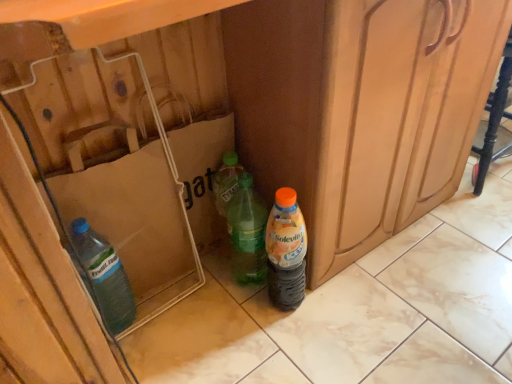
Question: Is orange matte plastic bottle at lower right, marked as the first bottle in a right-to-left arrangement, positioned far away from green translucent bottle at center, positioned as the 2th bottle in right-to-left order?

Choices:
 (A) yes
 (B) no

Answer: (B)

Question: Considering the relative positions of orange matte plastic bottle at lower right, which is the second bottle from left to right, and green translucent bottle at center, the 1th bottle from the left, in the image provided, is orange matte plastic bottle at lower right, which is the second bottle from left to right, to the left of green translucent bottle at center, the 1th bottle from the left, from the viewer's perspective?

Choices:
 (A) yes
 (B) no

Answer: (B)

Question: Is orange matte plastic bottle at lower right, marked as the first bottle in a right-to-left arrangement, outside green translucent bottle at center, positioned as the 2th bottle in right-to-left order?

Choices:
 (A) yes
 (B) no

Answer: (A)

Question: Is orange matte plastic bottle at lower right, marked as the first bottle in a right-to-left arrangement, in contact with green translucent bottle at center, the 1th bottle from the left?

Choices:
 (A) yes
 (B) no

Answer: (A)

Question: Could you tell me if orange matte plastic bottle at lower right, marked as the first bottle in a right-to-left arrangement, is facing green translucent bottle at center, positioned as the 2th bottle in right-to-left order?

Choices:
 (A) no
 (B) yes

Answer: (A)

Question: Would you say orange matte plastic bottle at lower right, marked as the first bottle in a right-to-left arrangement, contains green translucent bottle at center, positioned as the 2th bottle in right-to-left order?

Choices:
 (A) no
 (B) yes

Answer: (A)

Question: Can you confirm if green translucent bottle at center, the 1th bottle from the left, is positioned to the left of orange matte plastic bottle at lower right, which is the second bottle from left to right?

Choices:
 (A) yes
 (B) no

Answer: (A)

Question: Can you confirm if green translucent bottle at center, the 1th bottle from the left, is bigger than orange matte plastic bottle at lower right, which is the second bottle from left to right?

Choices:
 (A) no
 (B) yes

Answer: (B)

Question: Is green translucent bottle at center, positioned as the 2th bottle in right-to-left order, closer to camera compared to orange matte plastic bottle at lower right, marked as the first bottle in a right-to-left arrangement?

Choices:
 (A) no
 (B) yes

Answer: (A)

Question: Considering the relative sizes of green translucent bottle at center, the 1th bottle from the left, and orange matte plastic bottle at lower right, marked as the first bottle in a right-to-left arrangement, in the image provided, is green translucent bottle at center, the 1th bottle from the left, wider than orange matte plastic bottle at lower right, marked as the first bottle in a right-to-left arrangement,?

Choices:
 (A) yes
 (B) no

Answer: (A)

Question: Considering the relative positions of green translucent bottle at center, the 1th bottle from the left, and orange matte plastic bottle at lower right, marked as the first bottle in a right-to-left arrangement, in the image provided, is green translucent bottle at center, the 1th bottle from the left, to the right of orange matte plastic bottle at lower right, marked as the first bottle in a right-to-left arrangement, from the viewer's perspective?

Choices:
 (A) no
 (B) yes

Answer: (A)

Question: Is green translucent bottle at center, the 1th bottle from the left, thinner than orange matte plastic bottle at lower right, which is the second bottle from left to right?

Choices:
 (A) yes
 (B) no

Answer: (B)

Question: Looking at the image, does green translucent bottle at center, the 1th bottle from the left, seem bigger or smaller compared to orange matte plastic bottle at lower right, which is the second bottle from left to right?

Choices:
 (A) big
 (B) small

Answer: (A)